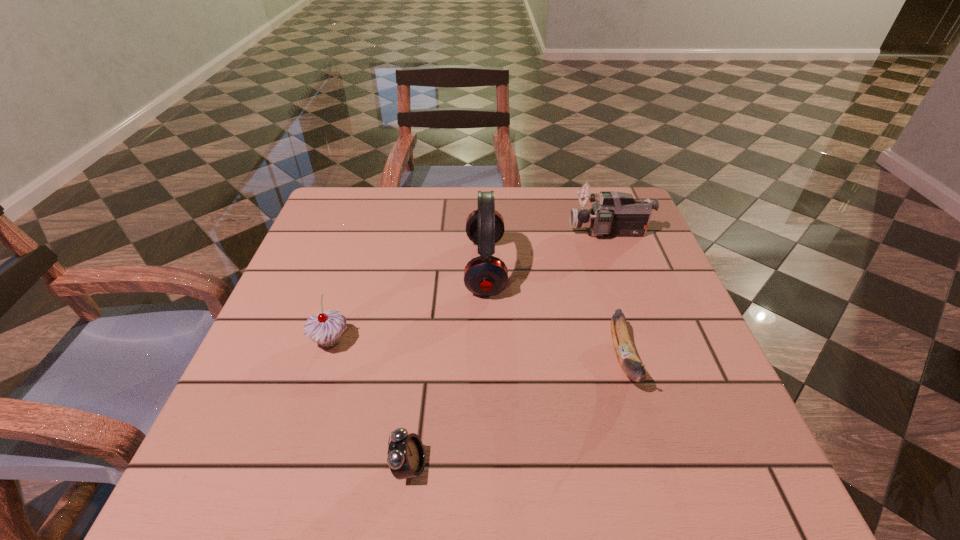
At what (x,y) coordinates should I click in order to perform the action: click on empty space between the cupcake and the banana. Please return your answer as a coordinate pair (x, y). Looking at the image, I should click on (477, 349).

The width and height of the screenshot is (960, 540). Find the location of `vacant space in between the earphone and the banana`. vacant space in between the earphone and the banana is located at coordinates (555, 313).

At what (x,y) coordinates should I click in order to perform the action: click on vacant space that is in between the cupcake and the banana. Please return your answer as a coordinate pair (x, y). Looking at the image, I should click on (477, 349).

Locate an element on the screen. This screenshot has width=960, height=540. empty space that is in between the tallest object and the nearest object is located at coordinates (447, 367).

Identify which object is the second nearest to the tallest object. Please provide its 2D coordinates. Your answer should be formatted as a tuple, i.e. [(x, y)], where the tuple contains the x and y coordinates of a point satisfying the conditions above.

[(629, 361)]

Identify the location of the third closest object to the earphone. This screenshot has height=540, width=960. [325, 328].

Where is `vacant region that satisfies the following two spatial constraints: 1. on the front-facing side of the camcorder; 2. on the front side of the cupcake`? vacant region that satisfies the following two spatial constraints: 1. on the front-facing side of the camcorder; 2. on the front side of the cupcake is located at coordinates (649, 341).